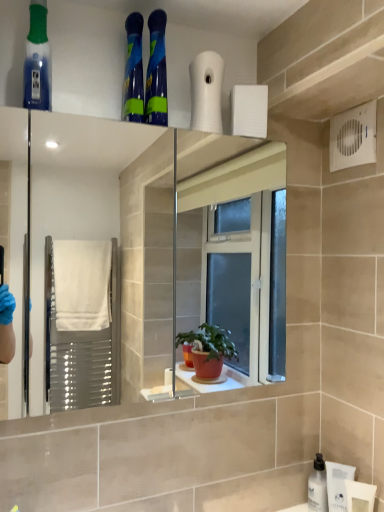
The width and height of the screenshot is (384, 512). Describe the element at coordinates (338, 485) in the screenshot. I see `white plastic bottle at lower right` at that location.

The image size is (384, 512). Find the location of `translucent blue mouthwash at upper left`. translucent blue mouthwash at upper left is located at coordinates (37, 61).

This screenshot has height=512, width=384. Identify the location of white plastic bottle at lower right. (338, 485).

In terms of size, does translucent blue mouthwash at upper left appear bigger or smaller than white plastic bottle at lower right?

translucent blue mouthwash at upper left is bigger than white plastic bottle at lower right.

Can you confirm if translucent blue mouthwash at upper left is shorter than white plastic bottle at lower right?

In fact, translucent blue mouthwash at upper left may be taller than white plastic bottle at lower right.

Is translucent blue mouthwash at upper left thinner than white plastic bottle at lower right?

No.

Is white plastic bottle at lower right touching white matte bottle at lower right?

Yes, white plastic bottle at lower right is in contact with white matte bottle at lower right.

Is white plastic bottle at lower right spatially inside white matte bottle at lower right, or outside of it?

white plastic bottle at lower right exists outside the volume of white matte bottle at lower right.

From a real-world perspective, is white plastic bottle at lower right above or below white matte bottle at lower right?

In terms of real-world spatial position, white plastic bottle at lower right is above white matte bottle at lower right.

Based on their positions, is white plastic bottle at lower right located to the left or right of white matte bottle at lower right?

In the image, white plastic bottle at lower right appears on the right side of white matte bottle at lower right.

Is white matte bottle at lower right closer to camera compared to white plastic bottle at lower right?

No, white matte bottle at lower right is further to the viewer.

Is point (320, 489) behind point (329, 493)?

Yes, it is behind point (329, 493).

Would you consider white matte bottle at lower right to be distant from white plastic bottle at lower right?

No, there isn't a large distance between white matte bottle at lower right and white plastic bottle at lower right.

Considering the sizes of white matte bottle at lower right and white plastic bottle at lower right in the image, is white matte bottle at lower right taller or shorter than white plastic bottle at lower right?

Clearly, white matte bottle at lower right is shorter compared to white plastic bottle at lower right.

Based on their sizes in the image, would you say white matte bottle at lower right is bigger or smaller than translucent blue mouthwash at upper left?

Considering their sizes, white matte bottle at lower right takes up less space than translucent blue mouthwash at upper left.

Is white matte bottle at lower right facing towards translucent blue mouthwash at upper left?

No, white matte bottle at lower right is not facing towards translucent blue mouthwash at upper left.

Is white matte bottle at lower right in contact with translucent blue mouthwash at upper left?

They are not placed beside each other.

Is white matte bottle at lower right not inside translucent blue mouthwash at upper left?

white matte bottle at lower right lies outside translucent blue mouthwash at upper left's area.

From a real-world perspective, is translucent blue mouthwash at upper left physically located above or below white matte bottle at lower right?

translucent blue mouthwash at upper left is situated higher than white matte bottle at lower right in the real world.

Is translucent blue mouthwash at upper left positioned beyond the bounds of white matte bottle at lower right?

translucent blue mouthwash at upper left lies outside white matte bottle at lower right's area.

Considering the sizes of objects translucent blue mouthwash at upper left and white matte bottle at lower right in the image provided, who is shorter, translucent blue mouthwash at upper left or white matte bottle at lower right?

white matte bottle at lower right is shorter.

From the image's perspective, is translucent blue mouthwash at upper left above or below white matte bottle at lower right?

translucent blue mouthwash at upper left is above white matte bottle at lower right.

Can you tell me how much white plastic bottle at lower right and translucent blue mouthwash at upper left differ in facing direction?

There is a 33.4-degree angle between the facing directions of white plastic bottle at lower right and translucent blue mouthwash at upper left.

Would you say white plastic bottle at lower right is outside translucent blue mouthwash at upper left?

Yes, white plastic bottle at lower right is located beyond the bounds of translucent blue mouthwash at upper left.

From the picture: Considering the sizes of white plastic bottle at lower right and translucent blue mouthwash at upper left in the image, is white plastic bottle at lower right wider or thinner than translucent blue mouthwash at upper left?

white plastic bottle at lower right is thinner than translucent blue mouthwash at upper left.

Between white plastic bottle at lower right and translucent blue mouthwash at upper left, which one appears on the left side from the viewer's perspective?

Positioned to the left is translucent blue mouthwash at upper left.

I want to click on toiletry below the translucent blue mouthwash at upper left (from the image's perspective), so click(x=338, y=485).

Where is `toiletry above the white matte bottle at lower right (from the image's perspective)`? toiletry above the white matte bottle at lower right (from the image's perspective) is located at coordinates (338, 485).

Based on their spatial positions, is white matte bottle at lower right or white plastic bottle at lower right further from translucent blue mouthwash at upper left?

white matte bottle at lower right is further to translucent blue mouthwash at upper left.

From the image, which object appears to be farther from white matte bottle at lower right, translucent blue mouthwash at upper left or white plastic bottle at lower right?

translucent blue mouthwash at upper left.

Estimate the real-world distances between objects in this image. Which object is closer to white matte bottle at lower right, white plastic bottle at lower right or translucent blue mouthwash at upper left?

white plastic bottle at lower right is positioned closer to the anchor white matte bottle at lower right.

From the image, which object appears to be nearer to translucent blue mouthwash at upper left, white plastic bottle at lower right or white matte bottle at lower right?

white plastic bottle at lower right.

Based on their spatial positions, is white matte bottle at lower right or translucent blue mouthwash at upper left further from white plastic bottle at lower right?

Among the two, translucent blue mouthwash at upper left is located further to white plastic bottle at lower right.

Estimate the real-world distances between objects in this image. Which object is closer to white plastic bottle at lower right, translucent blue mouthwash at upper left or white matte bottle at lower right?

The object closer to white plastic bottle at lower right is white matte bottle at lower right.

Where is `toiletry between translucent blue mouthwash at upper left and white matte bottle at lower right in the vertical direction`? Image resolution: width=384 pixels, height=512 pixels. toiletry between translucent blue mouthwash at upper left and white matte bottle at lower right in the vertical direction is located at coordinates (338, 485).